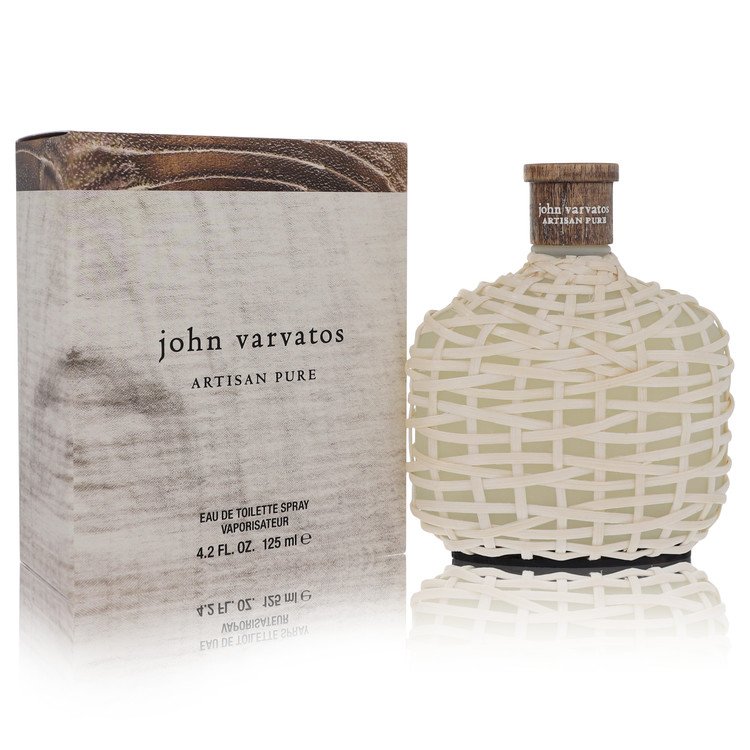
Find the location of a particular element. The width and height of the screenshot is (750, 750). vaporisateur is located at coordinates (252, 526).